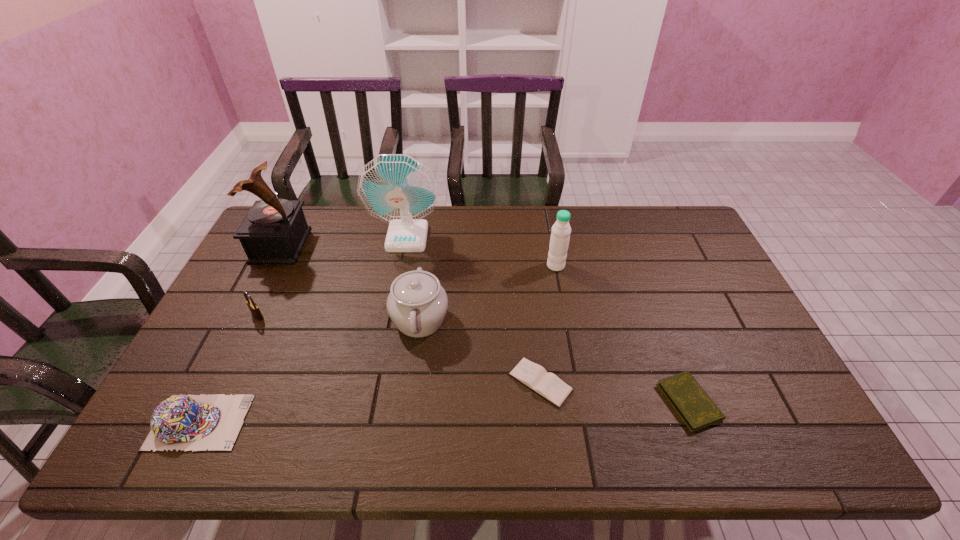
The width and height of the screenshot is (960, 540). I want to click on object that stands as the third closest to the fifth tallest object, so click(396, 188).

You are a GUI agent. You are given a task and a screenshot of the screen. Output one action in this format:
    pyautogui.click(x=<x>, y=<y>)
    Task: Click on the vacant space that satisfies the following two spatial constraints: 1. on the front side of the padlock; 2. on the left side of the left diary
    The image size is (960, 540).
    Given the screenshot: What is the action you would take?
    pyautogui.click(x=226, y=382)

You are a GUI agent. You are given a task and a screenshot of the screen. Output one action in this format:
    pyautogui.click(x=<x>, y=<y>)
    Task: Click on the free space that satisfies the following two spatial constraints: 1. at the horn opening of the phonograph_record; 2. on the left side of the left diary
    
    Given the screenshot: What is the action you would take?
    pyautogui.click(x=212, y=382)

You are a GUI agent. You are given a task and a screenshot of the screen. Output one action in this format:
    pyautogui.click(x=<x>, y=<y>)
    Task: Click on the vacant space that satisfies the following two spatial constraints: 1. in front of the fan to face the airflow; 2. at the horn opening of the phonograph_record
    Image resolution: width=960 pixels, height=540 pixels.
    Given the screenshot: What is the action you would take?
    pyautogui.click(x=406, y=246)

Find the location of `vacant point that satisfies the following two spatial constraints: 1. on the back side of the left diary; 2. on the left side of the sixth shortest object`. vacant point that satisfies the following two spatial constraints: 1. on the back side of the left diary; 2. on the left side of the sixth shortest object is located at coordinates (527, 266).

Identify the location of vacant point that satisfies the following two spatial constraints: 1. on the front side of the padlock; 2. on the front, side, and top of the cap. (207, 422).

Where is `free space that satisfies the following two spatial constraints: 1. in front of the left diary to face the airflow; 2. on the right side of the fan`? This screenshot has height=540, width=960. free space that satisfies the following two spatial constraints: 1. in front of the left diary to face the airflow; 2. on the right side of the fan is located at coordinates (380, 382).

I want to click on vacant region that satisfies the following two spatial constraints: 1. at the horn opening of the phonograph_record; 2. on the left side of the water bottle, so click(271, 266).

I want to click on free space that satisfies the following two spatial constraints: 1. in front of the fan to face the airflow; 2. on the right side of the water bottle, so click(402, 266).